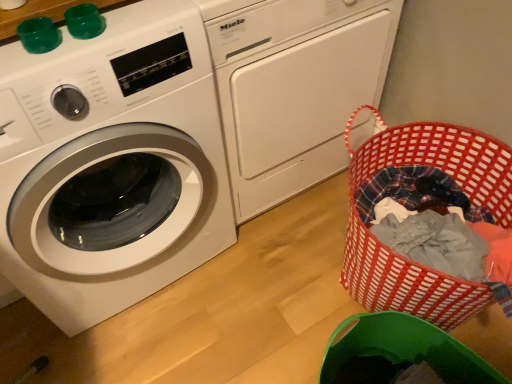
Question: From the image's perspective, relative to white glossy washing machine at left, the second washing machine from the right, is white glossy washing machine at left, which is the second washing machine from left to right, above or below?

Choices:
 (A) below
 (B) above

Answer: (B)

Question: Is white glossy washing machine at left, the first washing machine when ordered from right to left, inside the boundaries of white glossy washing machine at left, the second washing machine from the right, or outside?

Choices:
 (A) inside
 (B) outside

Answer: (B)

Question: Estimate the real-world distances between objects in this image. Which object is closer to the white glossy washing machine at left, which is the second washing machine from left to right?

Choices:
 (A) red woven laundry basket at lower right
 (B) white glossy washing machine at left, which ranks as the first washing machine in left-to-right order

Answer: (A)

Question: Which of these objects is positioned farthest from the white glossy washing machine at left, the first washing machine when ordered from right to left?

Choices:
 (A) white glossy washing machine at left, which ranks as the first washing machine in left-to-right order
 (B) red woven laundry basket at lower right

Answer: (A)